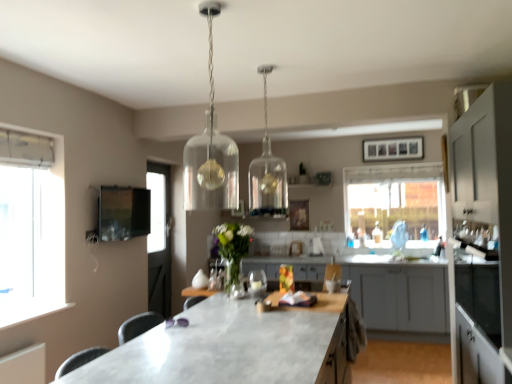
I want to click on free point above clear glass pendant light at upper center, positioned as the second lamp in front-to-back order (from a real-world perspective), so click(x=262, y=67).